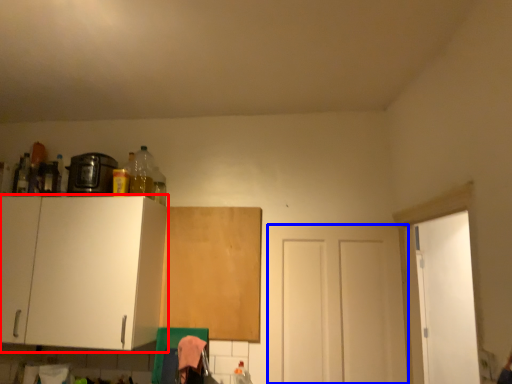
Question: Which point is further to the camera, cabinetry (highlighted by a red box) or door (highlighted by a blue box)?

Choices:
 (A) cabinetry
 (B) door

Answer: (B)